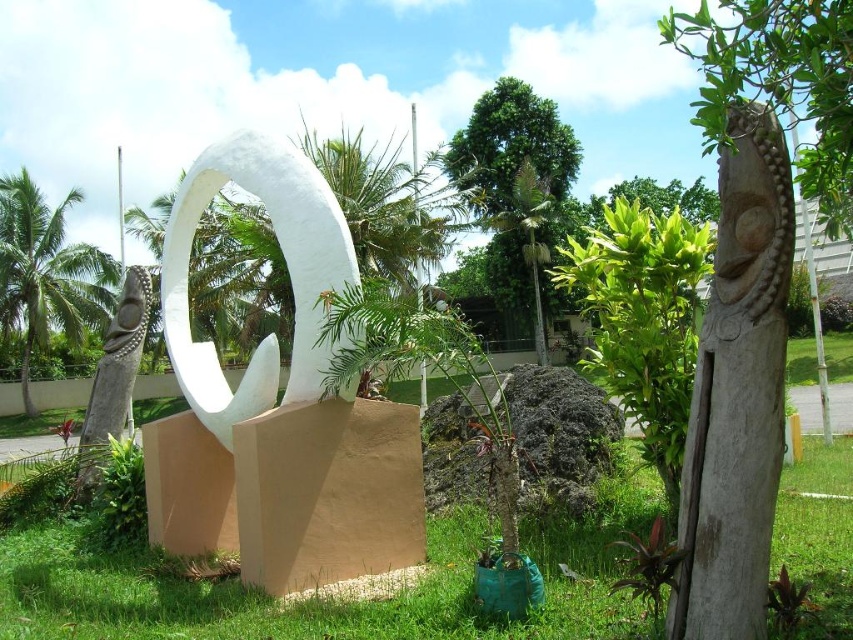
Measure the distance between white matte sculpture at center and green leafy palm tree at center.

The distance of white matte sculpture at center from green leafy palm tree at center is 21.60 meters.

Is white matte sculpture at center above green leafy palm tree at center?

Incorrect, white matte sculpture at center is not positioned above green leafy palm tree at center.

Locate an element on the screen. This screenshot has width=853, height=640. white matte sculpture at center is located at coordinates pos(277,406).

Identify the location of white matte sculpture at center. (277, 406).

Does green wood carving at upper right lie behind green leafy palm tree at left?

No, it is in front of green leafy palm tree at left.

Which of these two, green wood carving at upper right or green leafy palm tree at left, stands shorter?

green leafy palm tree at left

Between point (689, 36) and point (62, 269), which one is positioned in front?

Point (689, 36)

Identify the location of green wood carving at upper right. The image size is (853, 640). (780, 83).

Can you confirm if green grass at center is positioned to the right of smooth wood totem at right?

In fact, green grass at center is to the left of smooth wood totem at right.

Between green grass at center and smooth wood totem at right, which one appears on the left side from the viewer's perspective?

green grass at center

At what (x,y) coordinates should I click in order to perform the action: click on green grass at center. Please return your answer as a coordinate pair (x, y). Looking at the image, I should click on (328, 602).